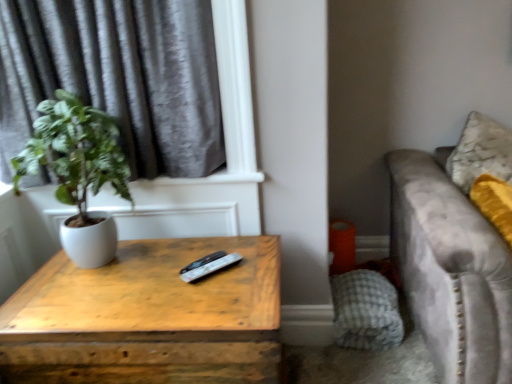
Locate an element on the screen. vacant area situated below white matte pot at left (from a real-world perspective) is located at coordinates (98, 269).